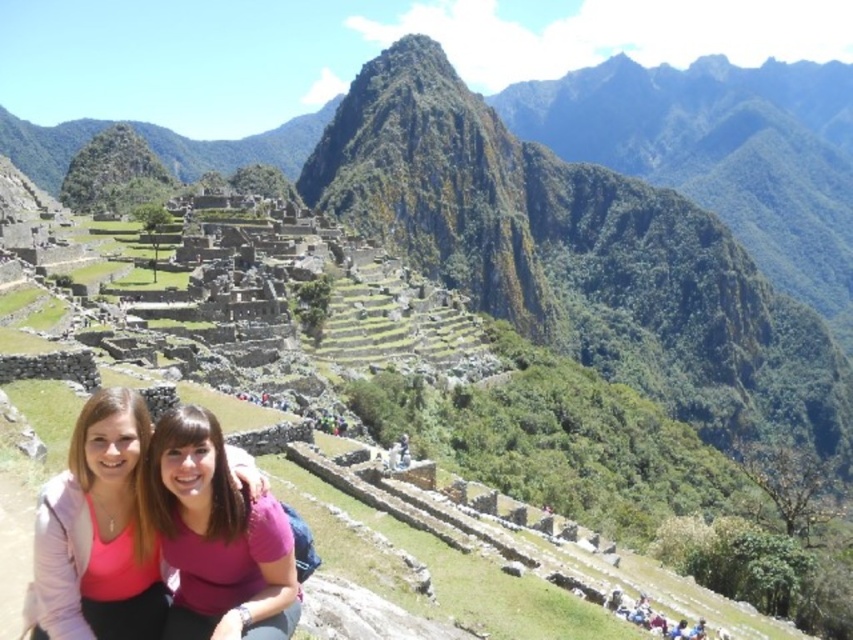
Question: Which point is closer to the camera?

Choices:
 (A) pink fabric at center
 (B) pink matte shirt at center

Answer: (A)

Question: Is pink fabric at center bigger than pink matte shirt at center?

Choices:
 (A) yes
 (B) no

Answer: (B)

Question: Does pink fabric at center appear on the right side of pink matte shirt at center?

Choices:
 (A) no
 (B) yes

Answer: (A)

Question: Is pink fabric at center in front of pink matte shirt at center?

Choices:
 (A) yes
 (B) no

Answer: (A)

Question: Which of the following is the closest to the observer?

Choices:
 (A) pink matte shirt at center
 (B) pink fabric at center

Answer: (B)

Question: Which of the following is the farthest from the observer?

Choices:
 (A) (76, 545)
 (B) (245, 573)

Answer: (B)